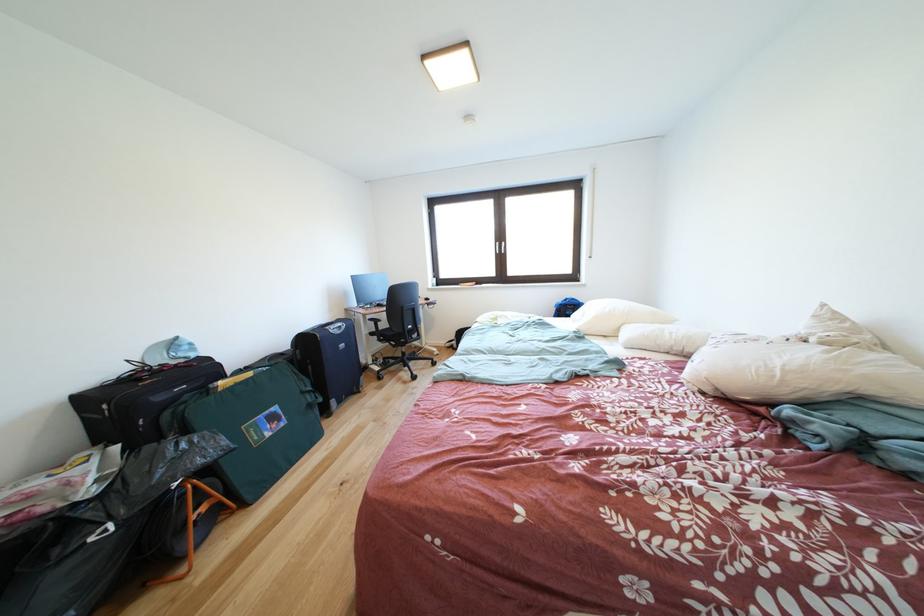
Where would you lift the green bag handle? Please return your answer as a coordinate pair (x, y).

(268, 430)